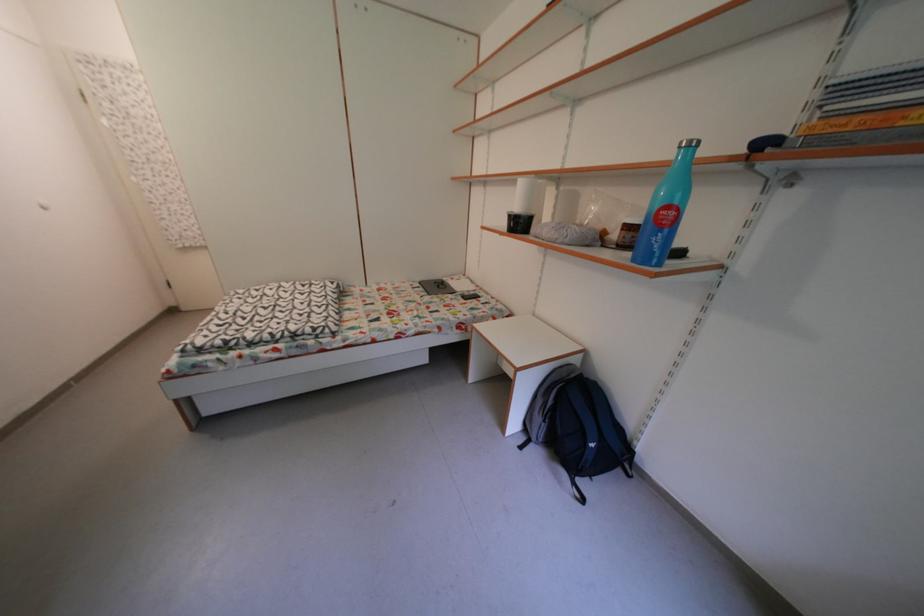
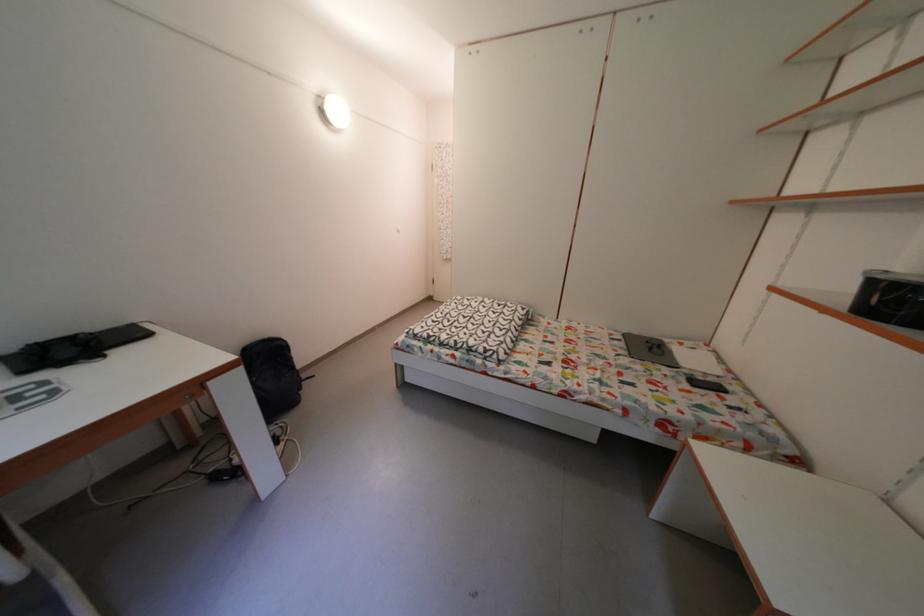
The point at (428,291) is marked in the first image. Where is the corresponding point in the second image?

(629, 342)